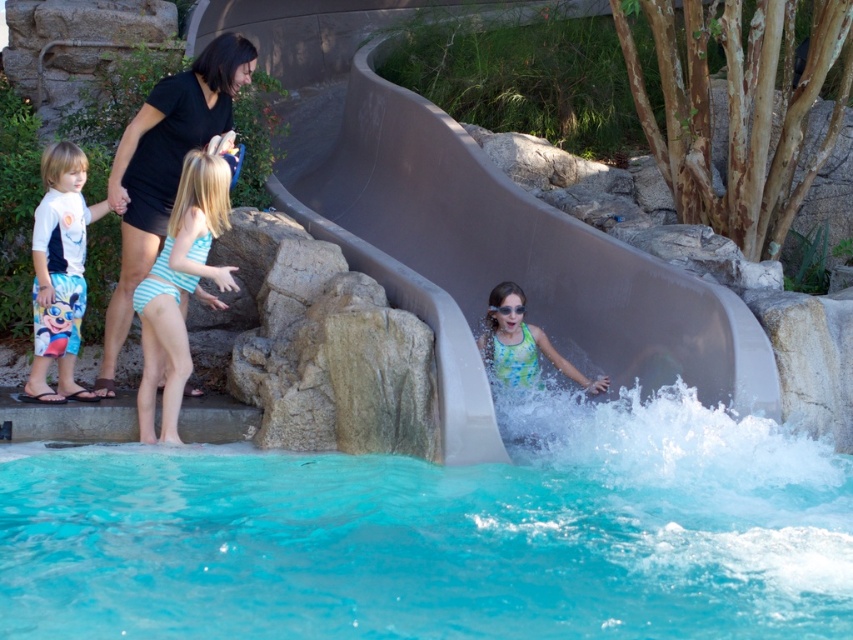
You are a photographer at the water park and need to capture a photo of the transparent plastic goggles at center without the black matte dress at upper left appearing in the frame. Is this possible given their positions?

The black matte dress at upper left is located above the transparent plastic goggles at center, so it would block the view of the goggles. Therefore, it is not possible to capture the transparent plastic goggles at center without the black matte dress at upper left appearing in the frame.

You are a lifeguard at the water park and need to ensure safety. The smooth gray slide at center and the blue striped swimsuit at left are both in your view. Which object is wider according to their sizes?

The smooth gray slide at center is wider than the blue striped swimsuit at left.